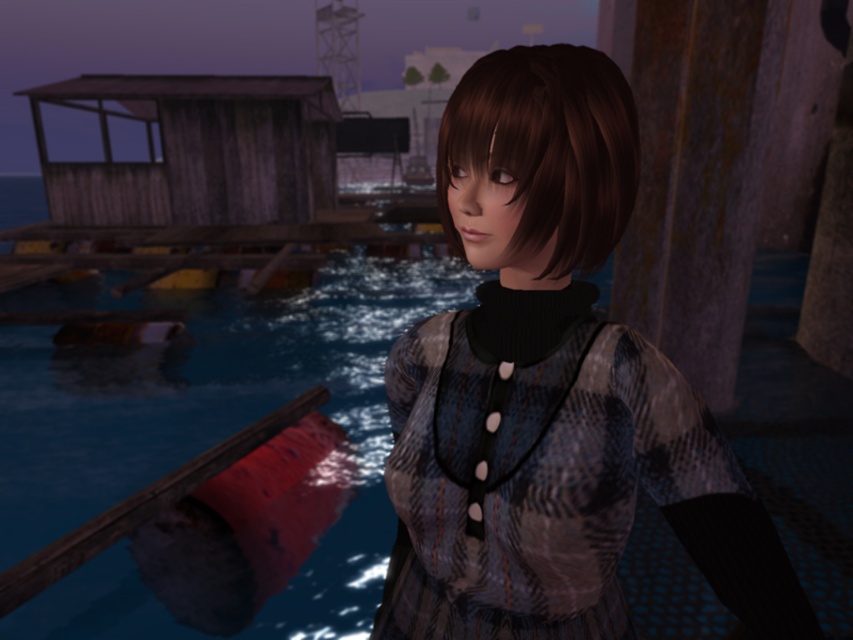
Consider the image. Is shiny brown hair at center to the left of wooden rail at lower left from the viewer's perspective?

Incorrect, shiny brown hair at center is not on the left side of wooden rail at lower left.

Can you confirm if shiny brown hair at center is taller than wooden rail at lower left?

No, shiny brown hair at center is not taller than wooden rail at lower left.

You are a GUI agent. You are given a task and a screenshot of the screen. Output one action in this format:
    pyautogui.click(x=<x>, y=<y>)
    Task: Click on the shiny brown hair at center
    The image size is (853, 640).
    Given the screenshot: What is the action you would take?
    pyautogui.click(x=546, y=148)

Can you confirm if striped fabric dress at center is bigger than shiny brown hair at center?

Indeed, striped fabric dress at center has a larger size compared to shiny brown hair at center.

Does striped fabric dress at center appear over shiny brown hair at center?

No, striped fabric dress at center is not above shiny brown hair at center.

Between point (509, 621) and point (621, 109), which one is positioned in front?

Positioned in front is point (621, 109).

Locate an element on the screen. striped fabric dress at center is located at coordinates (534, 480).

Image resolution: width=853 pixels, height=640 pixels. In order to click on textured brown hair at center in this screenshot , I will do [x=550, y=390].

Who is taller, textured brown hair at center or shiny brown hair at center?

textured brown hair at center is taller.

Between point (416, 513) and point (561, 99), which one is positioned in front?

Point (561, 99) is in front.

Image resolution: width=853 pixels, height=640 pixels. Identify the location of textured brown hair at center. (550, 390).